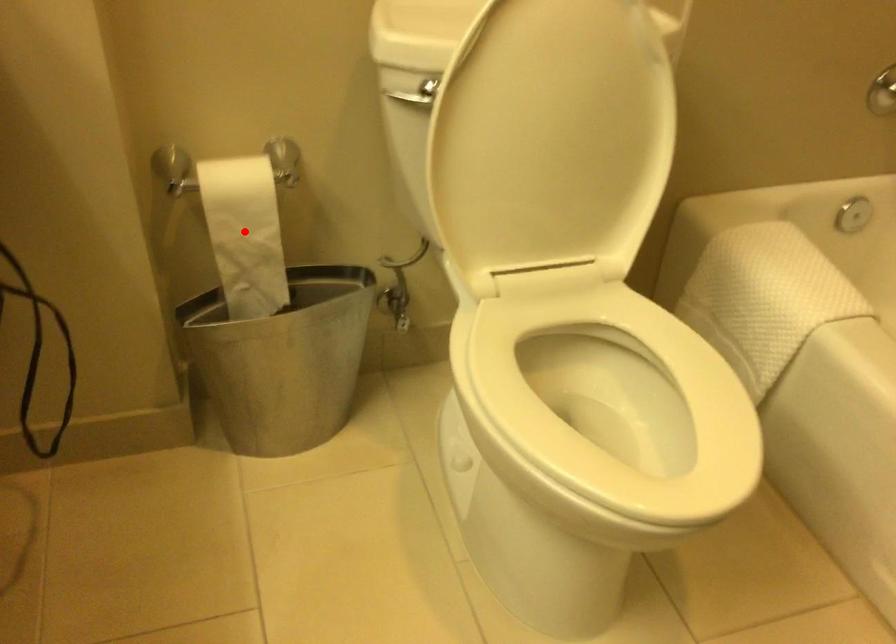
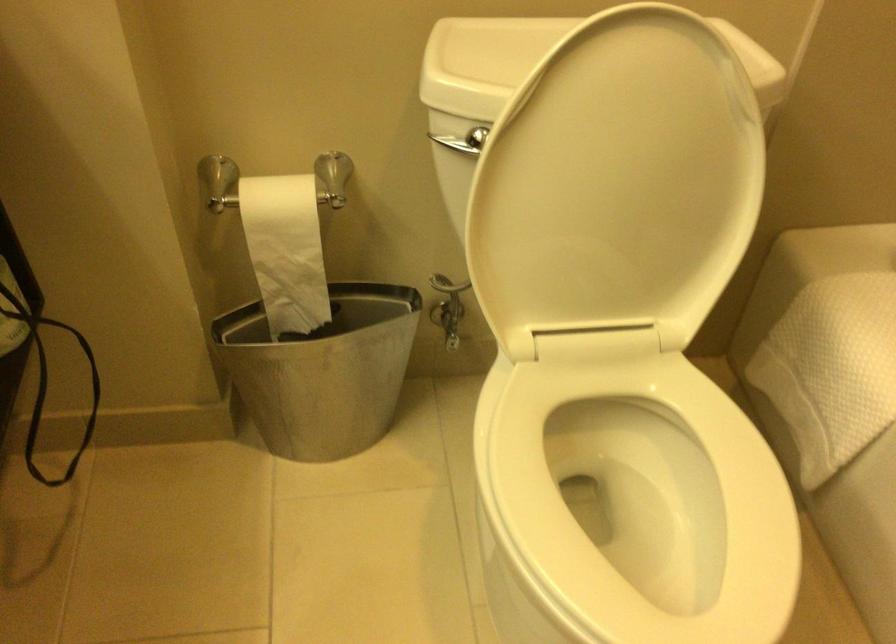
Where in the second image is the point corresponding to the highlighted location from the first image?

(286, 250)